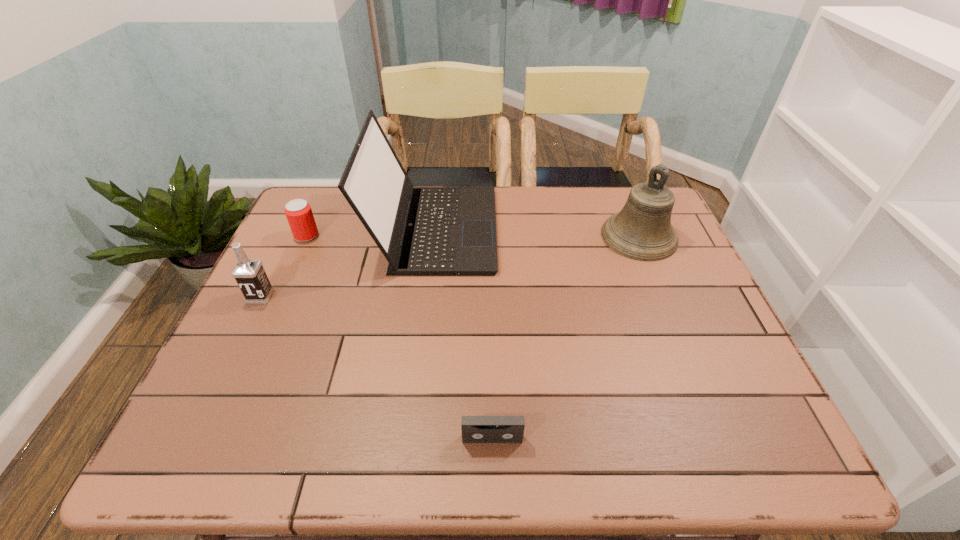
Locate an element on the screen. The width and height of the screenshot is (960, 540). laptop is located at coordinates [422, 231].

At what (x,y) coordinates should I click in order to perform the action: click on the second tallest object. Please return your answer as a coordinate pair (x, y). Image resolution: width=960 pixels, height=540 pixels. Looking at the image, I should click on [x=642, y=230].

Locate an element on the screen. the rightmost object is located at coordinates (642, 230).

Where is `the third tallest object`? This screenshot has height=540, width=960. the third tallest object is located at coordinates (249, 274).

Locate an element on the screen. the fourth farthest object is located at coordinates (249, 274).

You are a GUI agent. You are given a task and a screenshot of the screen. Output one action in this format:
    pyautogui.click(x=<x>, y=<y>)
    Task: Click on the fourth tallest object
    
    Given the screenshot: What is the action you would take?
    pyautogui.click(x=299, y=214)

This screenshot has height=540, width=960. What are the coordinates of `the shortest object` in the screenshot? It's located at (475, 429).

The height and width of the screenshot is (540, 960). What are the coordinates of `videotape` in the screenshot? It's located at (475, 429).

You are a GUI agent. You are given a task and a screenshot of the screen. Output one action in this format:
    pyautogui.click(x=<x>, y=<y>)
    Task: Click on the vacant region located 0.180m on the surface of the tallest object
    
    Given the screenshot: What is the action you would take?
    [557, 229]

At what (x,y) coordinates should I click in order to perform the action: click on free region located 0.340m on the left of the bell. Please return your answer as a coordinate pair (x, y). Image resolution: width=960 pixels, height=540 pixels. Looking at the image, I should click on (485, 237).